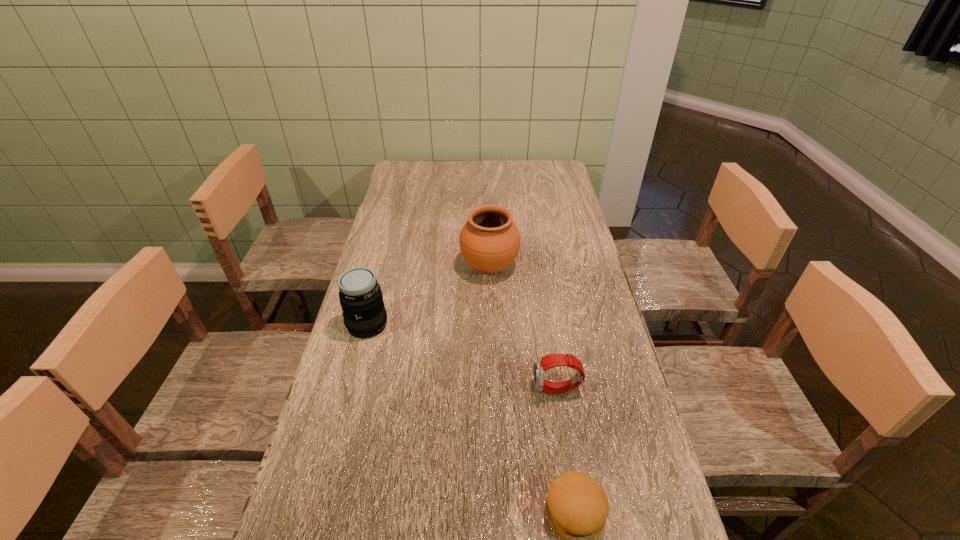
At what (x,y) coordinates should I click in order to perform the action: click on vacant space that's between the third nearest object and the watch. Please return your answer as a coordinate pair (x, y). Looking at the image, I should click on (462, 357).

Identify the location of vacant region between the leftmost object and the third tallest object. (462, 357).

Where is `free space between the leftmost object and the second nearest object`? The width and height of the screenshot is (960, 540). free space between the leftmost object and the second nearest object is located at coordinates (462, 357).

Identify the location of vacant space in between the watch and the leftmost object. This screenshot has height=540, width=960. (462, 357).

The image size is (960, 540). I want to click on empty location between the third tallest object and the telephoto lens, so click(462, 357).

Find the location of `object that is the second closest to the shortest object`. object that is the second closest to the shortest object is located at coordinates (360, 296).

I want to click on object that is the third closest to the telephoto lens, so click(x=576, y=508).

Where is `vacant space that satisfies the following two spatial constraints: 1. on the back side of the telephoto lens; 2. on the left side of the third object from right to left`? This screenshot has height=540, width=960. vacant space that satisfies the following two spatial constraints: 1. on the back side of the telephoto lens; 2. on the left side of the third object from right to left is located at coordinates (382, 267).